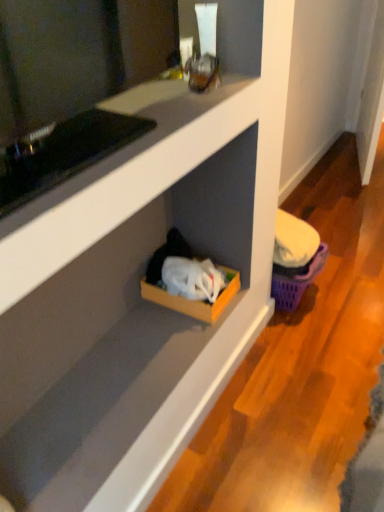
What do you see at coordinates (195, 300) in the screenshot?
I see `wooden cardboard box at lower center` at bounding box center [195, 300].

Measure the distance between wooden cardboard box at lower center and camera.

wooden cardboard box at lower center is 1.38 meters away from camera.

Find the location of `wooden cardboard box at lower center`. wooden cardboard box at lower center is located at coordinates (195, 300).

This screenshot has width=384, height=512. What do you see at coordinates (296, 280) in the screenshot? I see `purple plastic basket at lower right` at bounding box center [296, 280].

At what (x,y) coordinates should I click in order to perform the action: click on purple plastic basket at lower right. Please return your answer as a coordinate pair (x, y). The height and width of the screenshot is (512, 384). Looking at the image, I should click on 296,280.

Image resolution: width=384 pixels, height=512 pixels. I want to click on wooden cardboard box at lower center, so click(x=195, y=300).

Between purple plastic basket at lower right and wooden cardboard box at lower center, which one appears on the left side from the viewer's perspective?

From the viewer's perspective, wooden cardboard box at lower center appears more on the left side.

Is purple plastic basket at lower right positioned before wooden cardboard box at lower center?

No, purple plastic basket at lower right is further to the viewer.

Which is less distant, [308,268] or [233,269]?

Point [308,268] is positioned farther from the camera compared to point [233,269].

From the image's perspective, between purple plastic basket at lower right and wooden cardboard box at lower center, which one is located above?

From the image's view, purple plastic basket at lower right is above.

From a real-world perspective, who is located higher, purple plastic basket at lower right or wooden cardboard box at lower center?

From a 3D spatial view, wooden cardboard box at lower center is above.

Which of these two, purple plastic basket at lower right or wooden cardboard box at lower center, is wider?

With larger width is wooden cardboard box at lower center.

Looking at this image, between purple plastic basket at lower right and wooden cardboard box at lower center, which one has more height?

With more height is purple plastic basket at lower right.

Which of these two, purple plastic basket at lower right or wooden cardboard box at lower center, is bigger?

purple plastic basket at lower right.

Do you think purple plastic basket at lower right is within wooden cardboard box at lower center, or outside of it?

purple plastic basket at lower right is spatially situated outside wooden cardboard box at lower center.

Is purple plastic basket at lower right not close to wooden cardboard box at lower center?

No.

Is purple plastic basket at lower right facing towards wooden cardboard box at lower center?

No.

How far apart are purple plastic basket at lower right and wooden cardboard box at lower center?

They are 14.80 inches apart.

This screenshot has height=512, width=384. What are the coordinates of `storage box below the purple plastic basket at lower right (from the image's perspective)` in the screenshot? It's located at (195, 300).

Is wooden cardboard box at lower center at the left side of purple plastic basket at lower right?

Yes, wooden cardboard box at lower center is to the left of purple plastic basket at lower right.

Considering the relative positions of wooden cardboard box at lower center and purple plastic basket at lower right in the image provided, is wooden cardboard box at lower center in front of purple plastic basket at lower right?

Yes, the depth of wooden cardboard box at lower center is less than that of purple plastic basket at lower right.

Is point (203, 307) positioned before point (317, 269)?

Yes.

From the image's perspective, is wooden cardboard box at lower center beneath purple plastic basket at lower right?

Indeed, from the image's perspective, wooden cardboard box at lower center is shown beneath purple plastic basket at lower right.

From a real-world perspective, which object rests below the other?

purple plastic basket at lower right is physically lower.

In terms of width, does wooden cardboard box at lower center look wider or thinner when compared to purple plastic basket at lower right?

wooden cardboard box at lower center is wider than purple plastic basket at lower right.

Considering the sizes of objects wooden cardboard box at lower center and purple plastic basket at lower right in the image provided, who is taller, wooden cardboard box at lower center or purple plastic basket at lower right?

With more height is purple plastic basket at lower right.

In terms of size, does wooden cardboard box at lower center appear bigger or smaller than purple plastic basket at lower right?

A: Clearly, wooden cardboard box at lower center is smaller in size than purple plastic basket at lower right.

Is wooden cardboard box at lower center positioned beyond the bounds of purple plastic basket at lower right?

Yes, wooden cardboard box at lower center is located beyond the bounds of purple plastic basket at lower right.

Is wooden cardboard box at lower center far from purple plastic basket at lower right?

They are positioned close to each other.

Could you tell me if wooden cardboard box at lower center is turned towards purple plastic basket at lower right?

No, wooden cardboard box at lower center is not turned towards purple plastic basket at lower right.

What's the angular difference between wooden cardboard box at lower center and purple plastic basket at lower right's facing directions?

The facing directions of wooden cardboard box at lower center and purple plastic basket at lower right are 0.000855 degrees apart.

I want to click on basket located underneath the wooden cardboard box at lower center (from a real-world perspective), so click(296, 280).

This screenshot has height=512, width=384. Identify the location of basket behind the wooden cardboard box at lower center. (296, 280).

You are a GUI agent. You are given a task and a screenshot of the screen. Output one action in this format:
    pyautogui.click(x=<x>, y=<y>)
    Task: Click on the storage box above the purple plastic basket at lower right (from a real-world perspective)
    
    Given the screenshot: What is the action you would take?
    pyautogui.click(x=195, y=300)